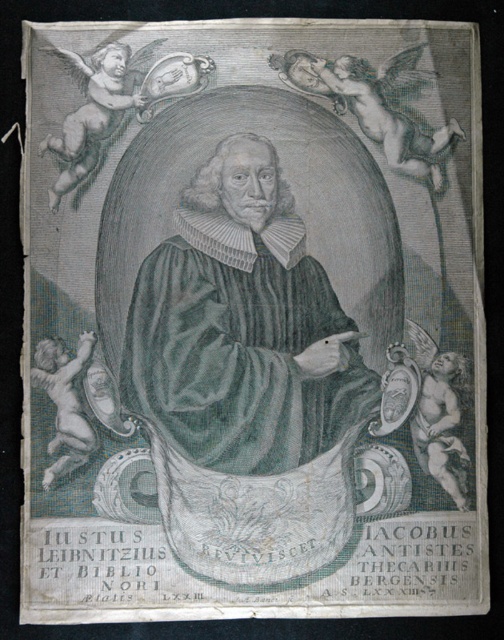
Does green striped robe at center have a greater height compared to smooth cherub at lower right?

Yes.

Is point (145, 296) positioned before point (430, 376)?

Yes, it is in front of point (430, 376).

Where is `green striped robe at center`? green striped robe at center is located at coordinates (241, 326).

Does green striped robe at center appear on the left side of smooth white cherub at upper left?

No, green striped robe at center is not to the left of smooth white cherub at upper left.

At what (x,y) coordinates should I click in order to perform the action: click on green striped robe at center. Please return your answer as a coordinate pair (x, y). The width and height of the screenshot is (504, 640). Looking at the image, I should click on (241, 326).

Which is below, green striped robe at center or smooth skin cherub at upper right?

Positioned lower is green striped robe at center.

Measure the distance between green striped robe at center and camera.

green striped robe at center and camera are 244.50 feet apart from each other.

Image resolution: width=504 pixels, height=640 pixels. What are the coordinates of `green striped robe at center` in the screenshot? It's located at (241, 326).